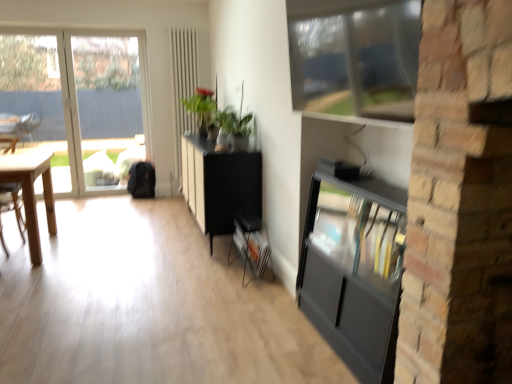
Locate an element on the screen. Image resolution: width=512 pixels, height=384 pixels. free space between light wood desk at left and metallic gray magazine rack at center is located at coordinates (126, 258).